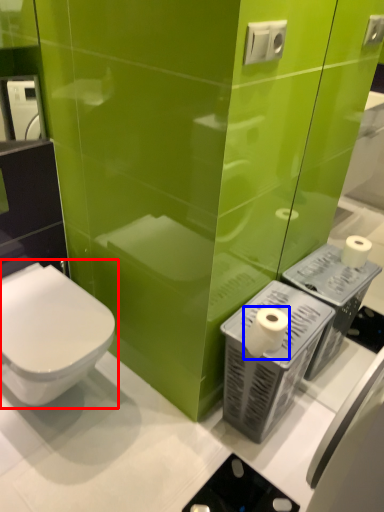
Question: Which point is closer to the camera, toilet (highlighted by a red box) or toilet paper (highlighted by a blue box)?

Choices:
 (A) toilet
 (B) toilet paper

Answer: (A)